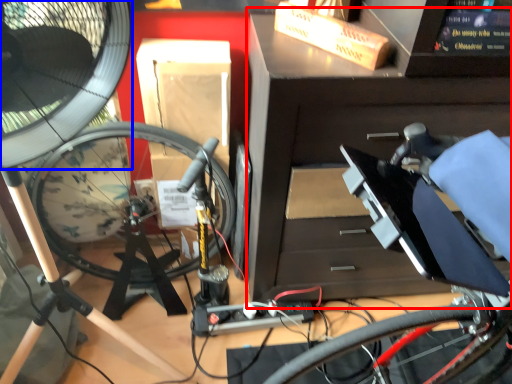
Question: Which object is further to the camera taking this photo, workbench (highlighted by a red box) or mechanical fan (highlighted by a blue box)?

Choices:
 (A) workbench
 (B) mechanical fan

Answer: (B)